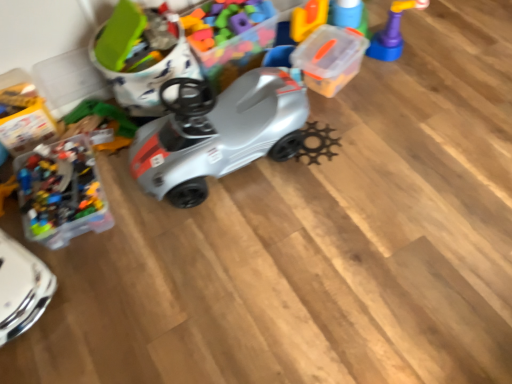
Question: Considering the positions of matte plastic toy car at upper left, which is counted as the 1th toy, starting from the left, and transparent plastic container at upper right, the second toy when ordered from right to left, in the image, is matte plastic toy car at upper left, which is counted as the 1th toy, starting from the left, wider or thinner than transparent plastic container at upper right, the second toy when ordered from right to left,?

Choices:
 (A) wide
 (B) thin

Answer: (A)

Question: From the image's perspective, is matte plastic toy car at upper left, which is counted as the 1th toy, starting from the left, located above or below transparent plastic container at upper right, the 2th toy viewed from the left?

Choices:
 (A) above
 (B) below

Answer: (B)

Question: Based on their relative distances, which object is nearer to the rubberized plastic toy at upper right, placed as the 1th toy when sorted from right to left?

Choices:
 (A) transparent plastic container at upper right, the second toy when ordered from right to left
 (B) matte plastic toy car at upper left, placed as the third toy when sorted from right to left

Answer: (A)

Question: Estimate the real-world distances between objects in this image. Which object is closer to the transparent plastic container at upper right, the second toy when ordered from right to left?

Choices:
 (A) matte plastic toy car at upper left, which is counted as the 1th toy, starting from the left
 (B) rubberized plastic toy at upper right, placed as the 1th toy when sorted from right to left

Answer: (B)